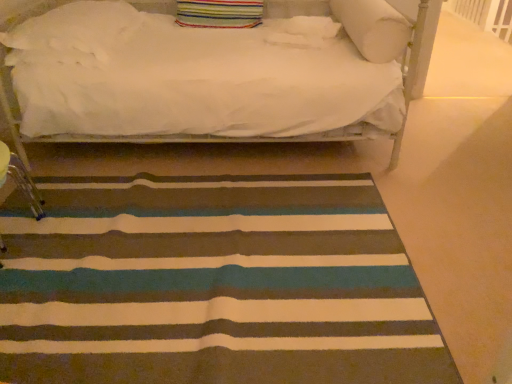
Question: Can you confirm if striped carpet at center is smaller than white soft pillow at upper right, which ranks as the fourth pillow in left-to-right order?

Choices:
 (A) yes
 (B) no

Answer: (B)

Question: From the image's perspective, is striped carpet at center on top of white soft pillow at upper right, marked as the 1th pillow in a right-to-left arrangement?

Choices:
 (A) yes
 (B) no

Answer: (B)

Question: Would you say white soft pillow at upper right, marked as the 1th pillow in a right-to-left arrangement, is part of striped carpet at center's contents?

Choices:
 (A) no
 (B) yes

Answer: (A)

Question: Is striped carpet at center bigger than white soft pillow at upper right, which ranks as the fourth pillow in left-to-right order?

Choices:
 (A) no
 (B) yes

Answer: (B)

Question: Does striped carpet at center appear on the left side of white soft pillow at upper right, marked as the 1th pillow in a right-to-left arrangement?

Choices:
 (A) yes
 (B) no

Answer: (A)

Question: Based on their sizes in the image, would you say striped fabric pillow at upper center, which is the 3th pillow in right-to-left order, is bigger or smaller than white fluffy pillow at upper left, arranged as the fourth pillow when viewed from the right?

Choices:
 (A) big
 (B) small

Answer: (B)

Question: In the image, is striped fabric pillow at upper center, arranged as the second pillow when viewed from the left, positioned in front of or behind white fluffy pillow at upper left, arranged as the fourth pillow when viewed from the right?

Choices:
 (A) front
 (B) behind

Answer: (B)

Question: In terms of height, does striped fabric pillow at upper center, arranged as the second pillow when viewed from the left, look taller or shorter compared to white fluffy pillow at upper left, the 1th pillow in the left-to-right sequence?

Choices:
 (A) short
 (B) tall

Answer: (A)

Question: From a real-world perspective, relative to white fluffy pillow at upper left, arranged as the fourth pillow when viewed from the right, is striped fabric pillow at upper center, which is the 3th pillow in right-to-left order, vertically above or below?

Choices:
 (A) below
 (B) above

Answer: (B)

Question: In terms of width, does white soft pillow at upper center, acting as the second pillow starting from the right, look wider or thinner when compared to striped fabric pillow at upper center, which is the 3th pillow in right-to-left order?

Choices:
 (A) wide
 (B) thin

Answer: (A)

Question: Is white soft pillow at upper center, acting as the second pillow starting from the right, inside the boundaries of striped fabric pillow at upper center, which is the 3th pillow in right-to-left order, or outside?

Choices:
 (A) outside
 (B) inside

Answer: (A)

Question: Would you say white soft pillow at upper center, the third pillow positioned from the left, is to the left or to the right of striped fabric pillow at upper center, which is the 3th pillow in right-to-left order, in the picture?

Choices:
 (A) left
 (B) right

Answer: (B)

Question: Considering the positions of point tap(301, 28) and point tap(259, 11), is point tap(301, 28) closer or farther from the camera than point tap(259, 11)?

Choices:
 (A) farther
 (B) closer

Answer: (B)

Question: From a real-world perspective, is striped fabric pillow at upper center, which is the 3th pillow in right-to-left order, above or below white soft pillow at upper center, acting as the second pillow starting from the right?

Choices:
 (A) below
 (B) above

Answer: (B)

Question: Is striped fabric pillow at upper center, arranged as the second pillow when viewed from the left, in front of or behind white soft pillow at upper center, acting as the second pillow starting from the right, in the image?

Choices:
 (A) behind
 (B) front

Answer: (A)